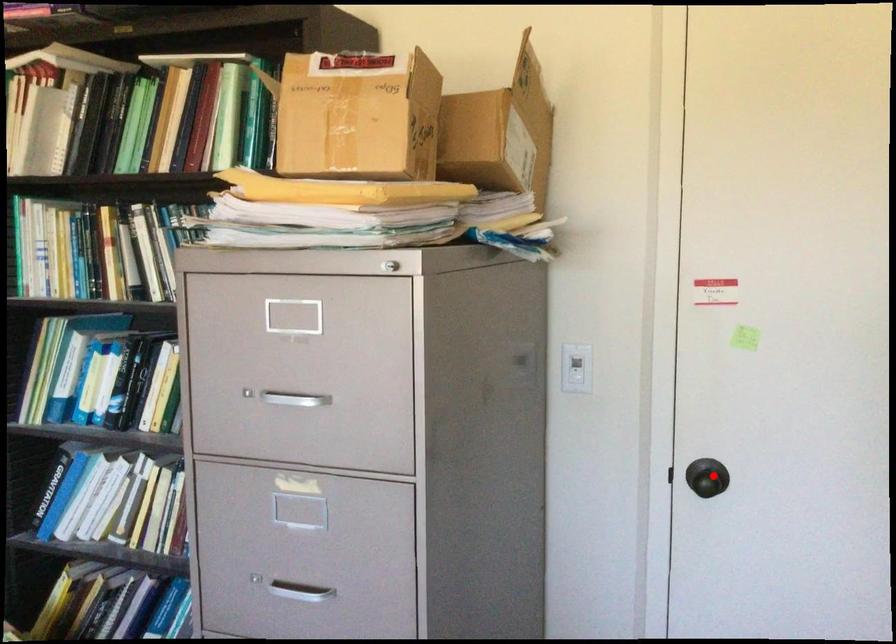
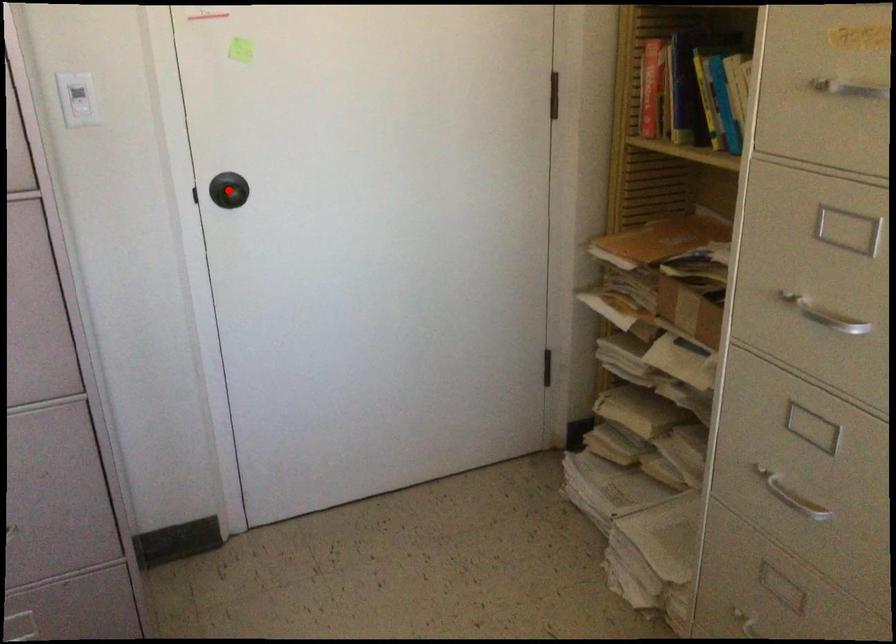
I am providing you with two images of the same scene from different viewpoints. A red point is marked on the first image and another point is marked on the second image. Is the marked point in image1 the same physical position as the marked point in image2?

Yes